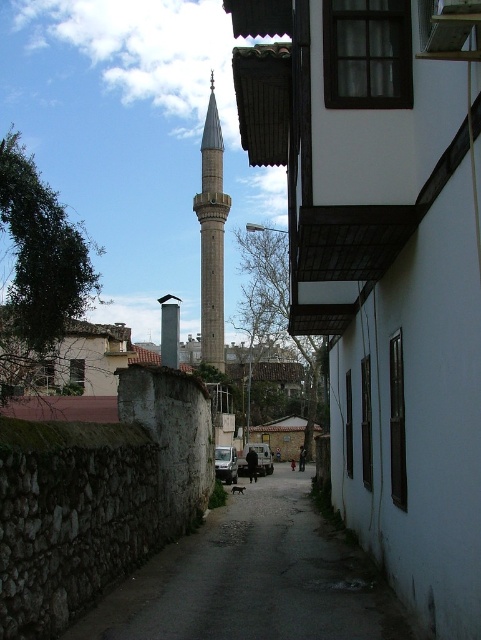
Question: Which object is farther from the camera taking this photo?

Choices:
 (A) stone wall at center
 (B) gray stone minaret at center
 (C) smooth gray chimney at center

Answer: (B)

Question: Which of the following is the closest to the observer?

Choices:
 (A) (226, 196)
 (B) (163, 305)

Answer: (B)

Question: Can you confirm if stone wall at center is bigger than smooth gray chimney at center?

Choices:
 (A) no
 (B) yes

Answer: (A)

Question: Can you confirm if gray stone minaret at center is smaller than smooth gray chimney at center?

Choices:
 (A) no
 (B) yes

Answer: (A)

Question: Is gray stone minaret at center below smooth gray chimney at center?

Choices:
 (A) yes
 (B) no

Answer: (B)

Question: Which point is closer to the camera taking this photo?

Choices:
 (A) (213, 326)
 (B) (173, 314)
 (C) (163, 627)

Answer: (C)